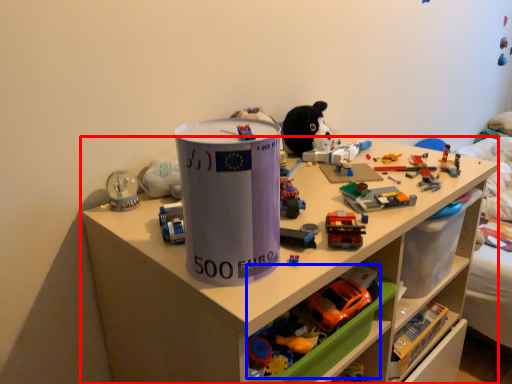
Question: Which object appears closest to the camera in this image, shelf (highlighted by a red box) or toy (highlighted by a blue box)?

Choices:
 (A) shelf
 (B) toy

Answer: (A)